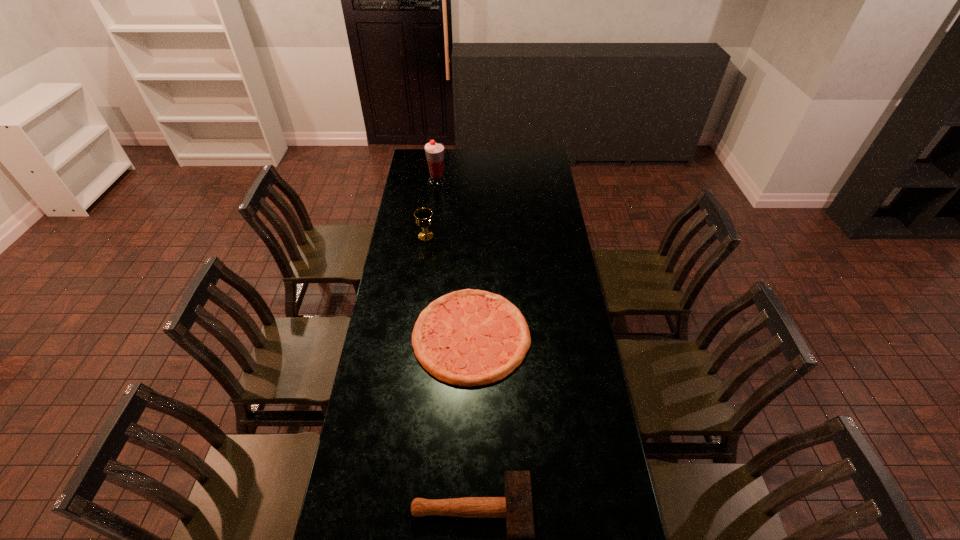
Locate an element on the screen. the farthest object is located at coordinates (434, 151).

Where is `the tallest object`? the tallest object is located at coordinates (434, 151).

Image resolution: width=960 pixels, height=540 pixels. I want to click on chalice, so click(423, 216).

Where is `the third nearest object`? The height and width of the screenshot is (540, 960). the third nearest object is located at coordinates (423, 216).

Find the location of a particular element. The height and width of the screenshot is (540, 960). the second nearest object is located at coordinates (469, 337).

The image size is (960, 540). In order to click on pizza in this screenshot , I will do click(469, 337).

This screenshot has width=960, height=540. In order to click on free region located 0.290m on the back of the farthest object in this screenshot , I will do coord(441,151).

Image resolution: width=960 pixels, height=540 pixels. I want to click on vacant space positioned 0.050m on the back of the third nearest object, so click(x=427, y=224).

This screenshot has width=960, height=540. I want to click on free spot located 0.230m on the back of the third farthest object, so click(x=472, y=256).

I want to click on smoothie that is at the left edge, so 434,151.